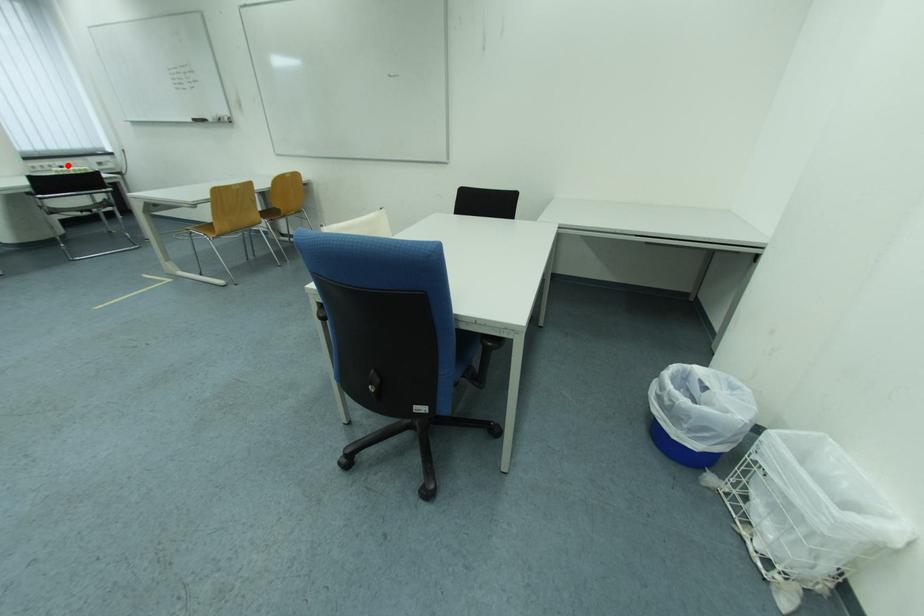
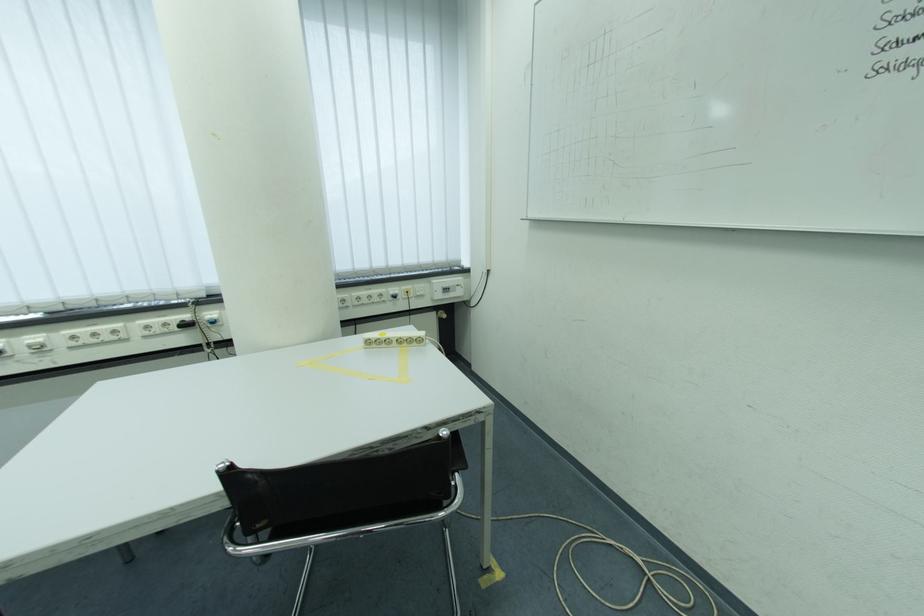
The point at the highlighted location is marked in the first image. Where is the corresponding point in the second image?

(402, 291)